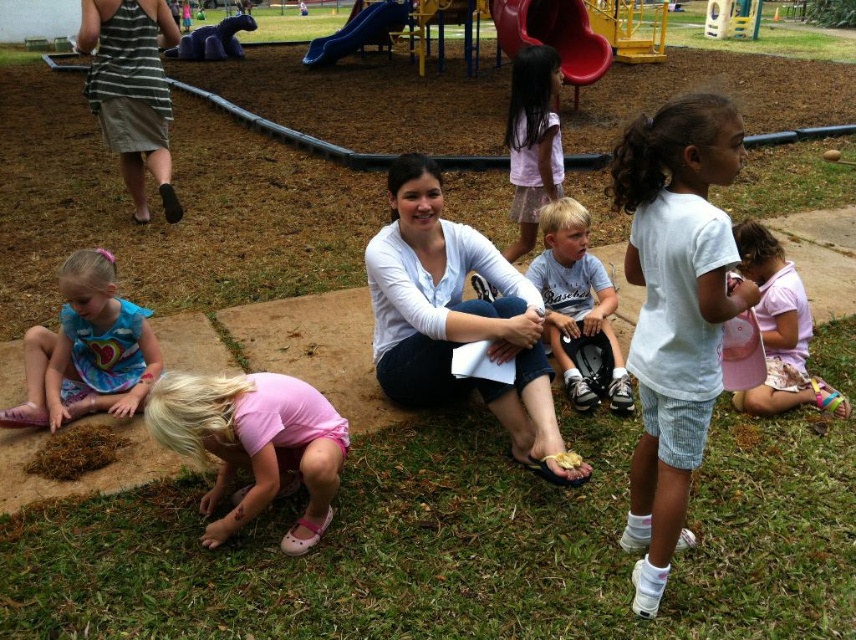
Question: Which of these objects is positioned closest to the purple fabric slide at upper center?

Choices:
 (A) smooth plastic slide at upper center
 (B) pink fabric dress at lower center
 (C) white cotton shirt at center
 (D) white matte shirt at center

Answer: (A)

Question: Can you confirm if blue cotton dress at lower left is positioned to the right of pink fabric hat at lower right?

Choices:
 (A) yes
 (B) no

Answer: (B)

Question: Does white matte shirt at center appear on the right side of smooth plastic slide at upper center?

Choices:
 (A) yes
 (B) no

Answer: (B)

Question: Which point appears closest to the camera in this image?

Choices:
 (A) (633, 250)
 (B) (370, 26)

Answer: (A)

Question: Is white matte shirt at center behind light blue cotton shirt at center?

Choices:
 (A) no
 (B) yes

Answer: (A)

Question: Among these objects, which one is farthest from the camera?

Choices:
 (A) smooth blue slide at upper center
 (B) light blue cotton shirt at center
 (C) white matte shirt at center

Answer: (A)